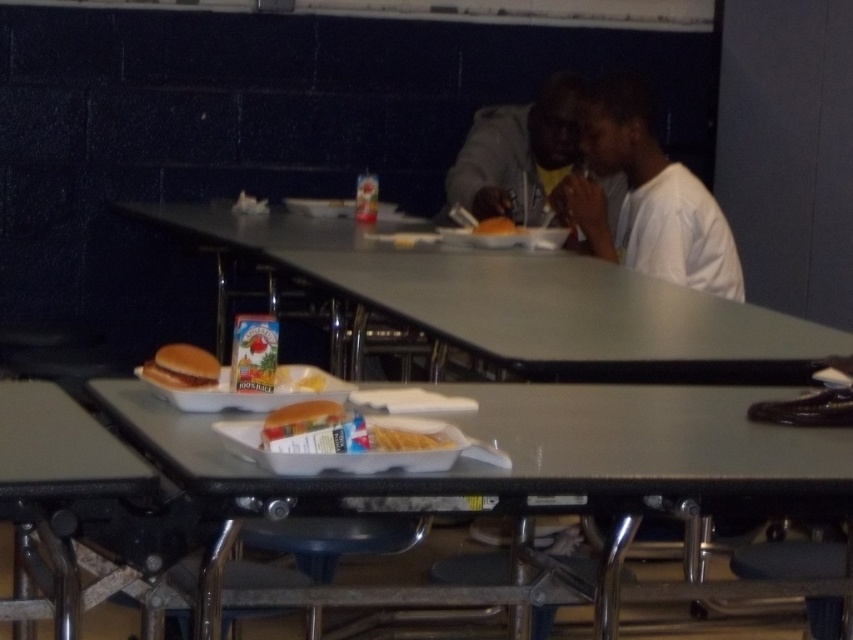
You are standing in front of the dining table and want to pick up both items located at point (689, 465) and point (566, 108). Which item should you reach for first to minimize the distance you have to move your hand?

You should reach for the item at point (689, 465) first because it is closer to you than the item at point (566, 108).

From the picture: You are a food delivery robot. You need to place a large pizza on the table without it touching any existing items. The table has a dark gray hoodie at upper right and a white paper plate at upper center. Which item should you avoid placing the pizza near to ensure it doesn

The dark gray hoodie at upper right might be wider than the white paper plate at upper center, so placing the pizza near the dark gray hoodie at upper right could cause it to touch the pizza due to its larger size. Avoid placing the pizza near the dark gray hoodie at upper right.

You are a cafeteria worker who needs to place a new menu card between the white paper tray at center and the white paper plate at upper center. The menu card is 1 foot wide. Is there enough space between them to fit the menu card without moving either item?

The distance between the white paper tray at center and the white paper plate at upper center is 7.08 feet. Since the menu card is only 1 foot wide, there is ample space to place it between them without moving either item.